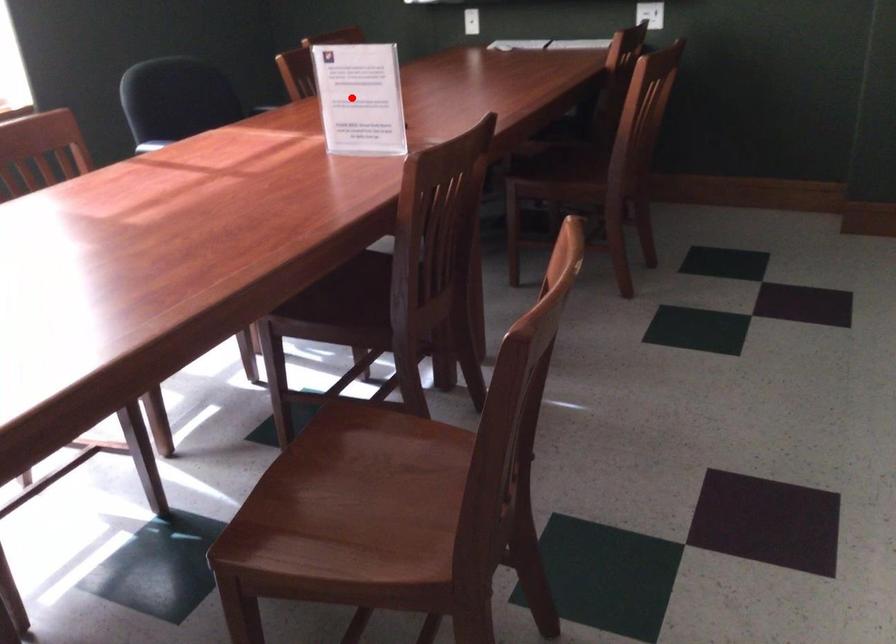
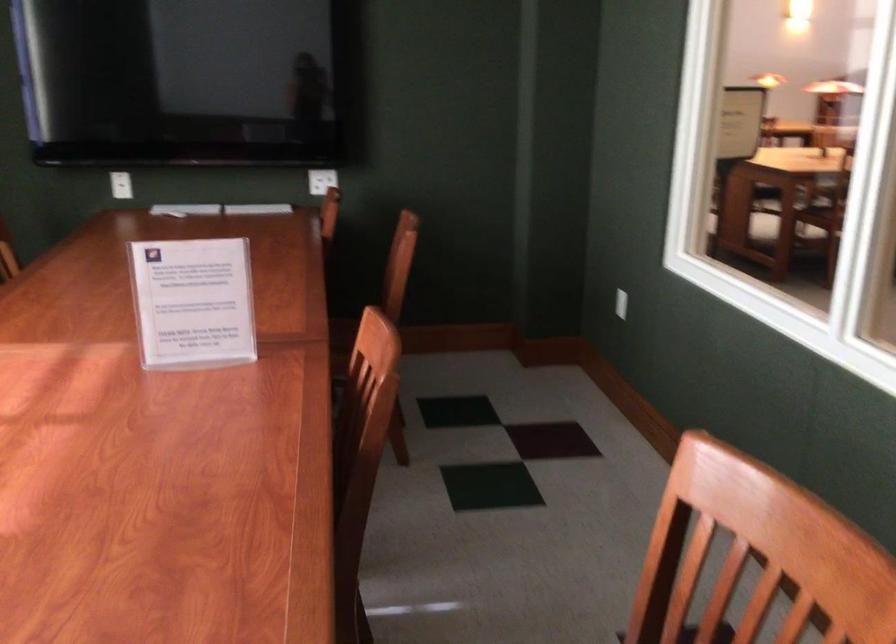
Question: I am providing you with two images of the same scene from different viewpoints. Image1 has a red point marked. In image2, the corresponding 3D location appears at what relative position? Reply with the corresponding letter.

Choices:
 (A) Closer
 (B) Farther

Answer: (A)